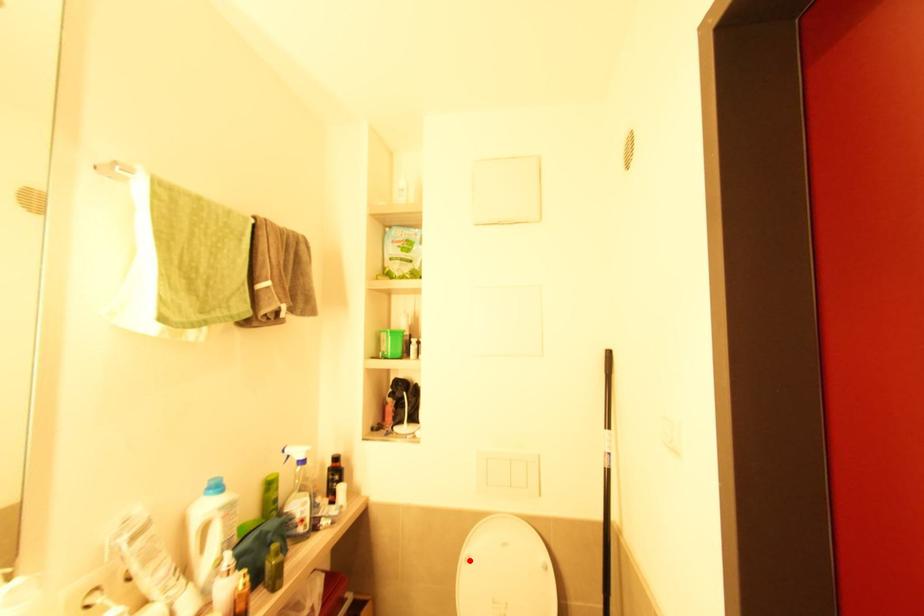
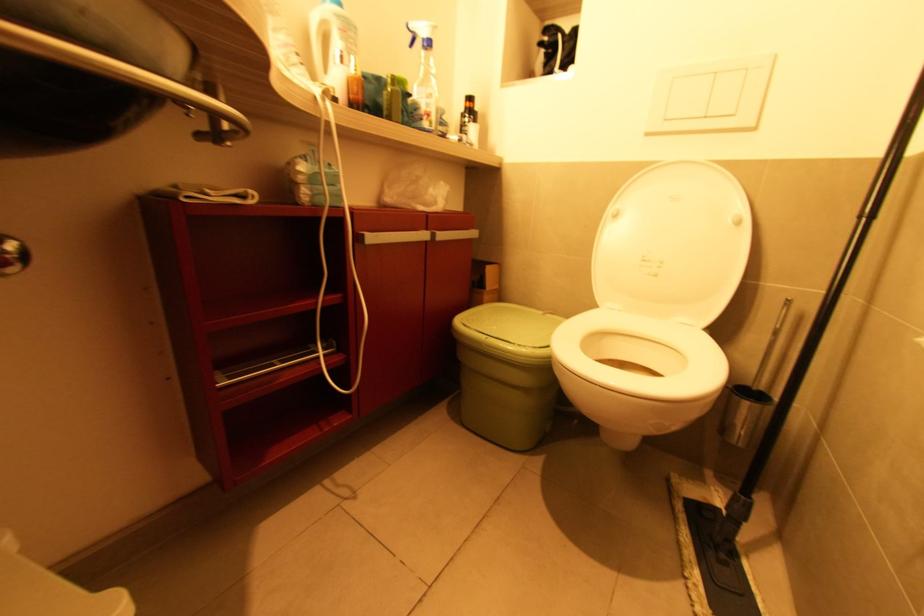
In the second image, find the point that corresponds to the highlighted location in the first image.

(617, 217)